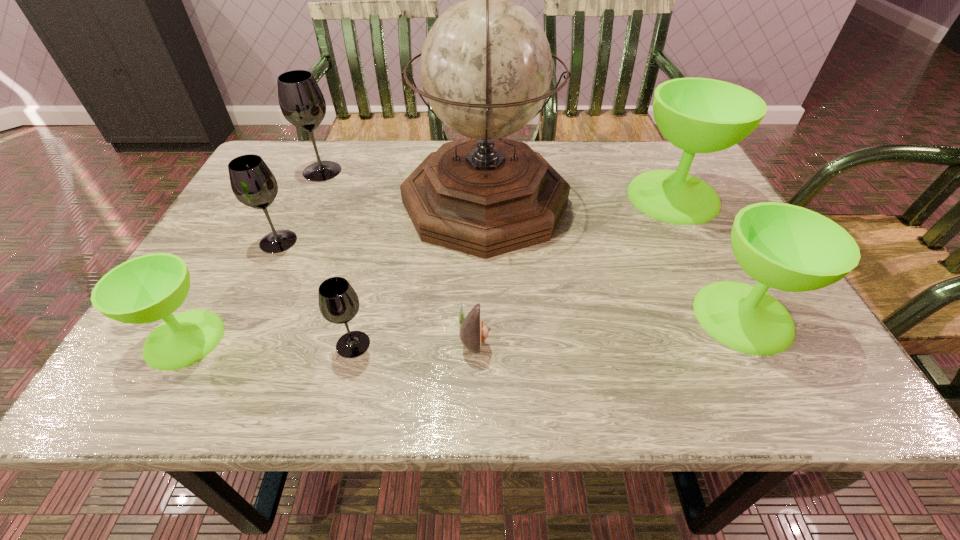
Locate an element on the screen. This screenshot has width=960, height=540. free region located 0.080m on the surface of the globe is located at coordinates (371, 202).

Find the location of a particular element. free space located 0.180m on the surface of the globe is located at coordinates (330, 202).

This screenshot has width=960, height=540. I want to click on vacant region located 0.050m on the surface of the globe, so click(382, 202).

Where is `vacant space located on the right of the farthest gray wineglass`? The image size is (960, 540). vacant space located on the right of the farthest gray wineglass is located at coordinates (386, 171).

At what (x,y) coordinates should I click in order to perform the action: click on vacant space located 0.250m on the front of the biggest green wineglass. Please return your answer as a coordinate pair (x, y). The width and height of the screenshot is (960, 540). Looking at the image, I should click on (729, 306).

Where is `free space located on the left of the second nearest gray wineglass`? This screenshot has height=540, width=960. free space located on the left of the second nearest gray wineglass is located at coordinates (228, 241).

Locate an element on the screen. The height and width of the screenshot is (540, 960). vacant space located on the front of the second smallest green wineglass is located at coordinates (777, 380).

Find the location of a particular element. free space located 0.290m on the right of the smallest green wineglass is located at coordinates (378, 339).

This screenshot has width=960, height=540. I want to click on vacant space positioned 0.300m on the left of the fifth object from right to left, so click(172, 345).

At what (x,y) coordinates should I click in order to perform the action: click on vacant space positioned on the seed side of the avocado. Please return your answer as a coordinate pair (x, y). The image size is (960, 540). Looking at the image, I should click on (561, 338).